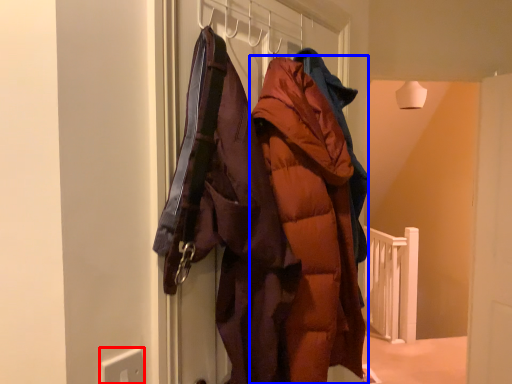
Question: Among these objects, which one is farthest to the camera, electric outlet (highlighted by a red box) or coat (highlighted by a blue box)?

Choices:
 (A) electric outlet
 (B) coat

Answer: (B)